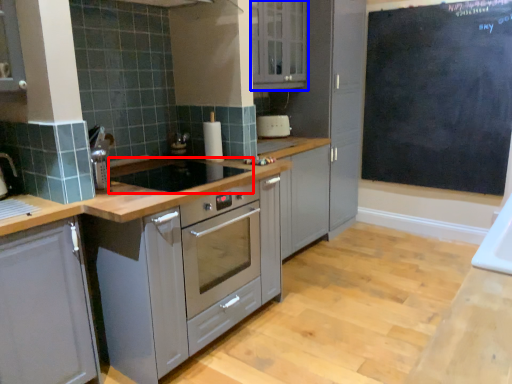
Question: Which object appears closest to the camera in this image, gas stove (highlighted by a red box) or cabinetry (highlighted by a blue box)?

Choices:
 (A) gas stove
 (B) cabinetry

Answer: (A)